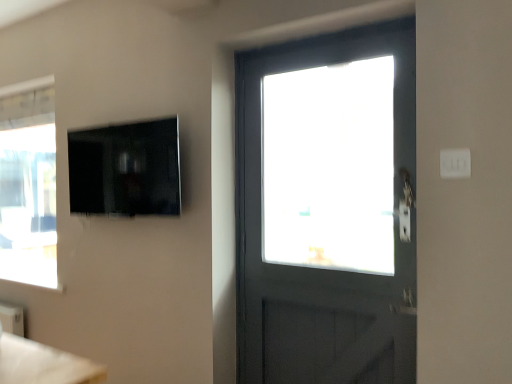
Question: Considering the positions of matte black tv at upper left and white plastic light switch at upper right in the image, is matte black tv at upper left taller or shorter than white plastic light switch at upper right?

Choices:
 (A) short
 (B) tall

Answer: (B)

Question: From a real-world perspective, relative to white plastic light switch at upper right, is matte black tv at upper left vertically above or below?

Choices:
 (A) above
 (B) below

Answer: (A)

Question: Relative to white plastic light switch at upper right, is matte black tv at upper left in front or behind?

Choices:
 (A) behind
 (B) front

Answer: (A)

Question: Looking at the image, does white plastic light switch at upper right seem bigger or smaller compared to matte black tv at upper left?

Choices:
 (A) small
 (B) big

Answer: (A)

Question: Considering their positions, is white plastic light switch at upper right located in front of or behind matte black tv at upper left?

Choices:
 (A) front
 (B) behind

Answer: (A)

Question: From a real-world perspective, relative to matte black tv at upper left, is white plastic light switch at upper right vertically above or below?

Choices:
 (A) above
 (B) below

Answer: (B)

Question: Choose the correct answer: Is white plastic light switch at upper right inside matte black tv at upper left or outside it?

Choices:
 (A) outside
 (B) inside

Answer: (A)